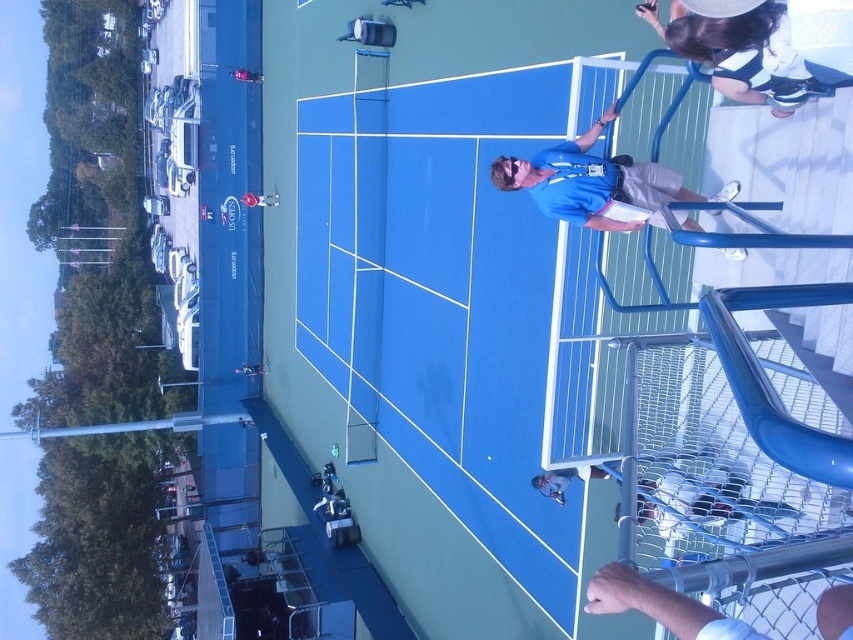
You are standing on the tennis court and want to retrieve a tennis ball that rolled to the point marked as point (724,634). If you can reach 7 feet without moving, can you grab it?

Result: The point (724,634) is 7.88 feet away from the viewer. Since you can only reach 7 feet without moving, you cannot grab it without moving closer.

You are standing at the center of the tennis court and want to hand a water bottle to the person in the blue fabric shirt at upper center. In which direction should you move to reach them?

The blue fabric shirt at upper center is located at point 0.287 on the x and 0.696 on the y coordinates. Since you are at the center, you should move towards the upper center direction to reach them.

You are a tennis player standing at the center of the court. You need to quickly retrieve a ball that landed at point (593, 182). Which direction should you move to reach the ball?

The blue fabric shirt at upper center is located at point (593, 182), so you should move towards the upper center direction to reach the ball.